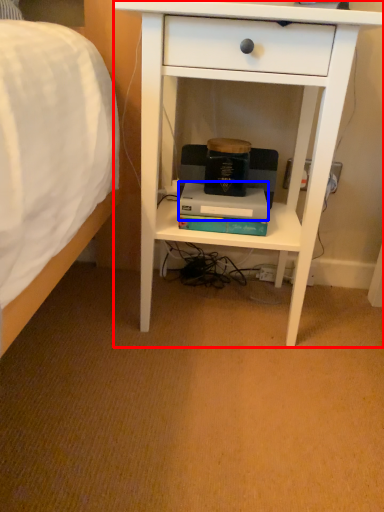
Question: Among these objects, which one is nearest to the camera, desk (highlighted by a red box) or paperback book (highlighted by a blue box)?

Choices:
 (A) desk
 (B) paperback book

Answer: (A)